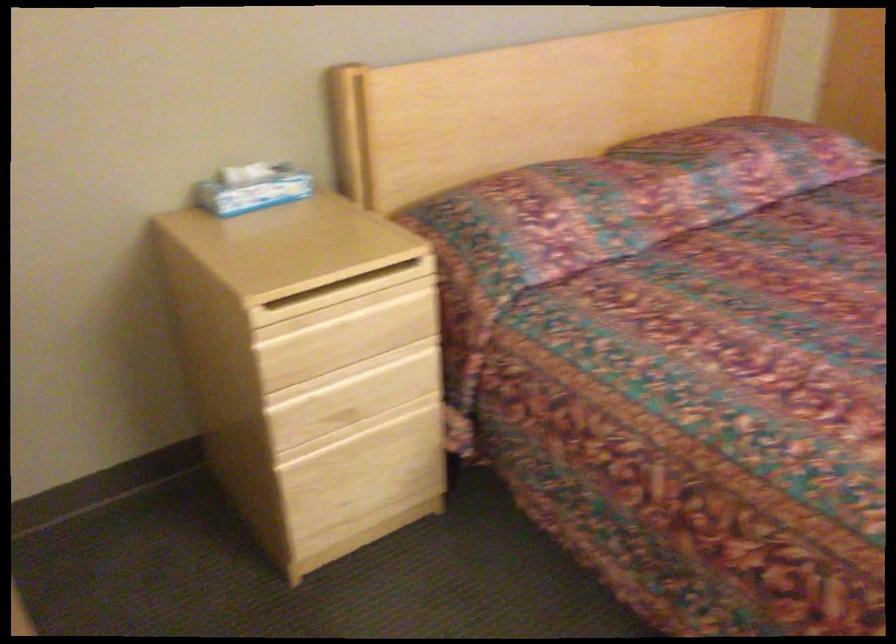
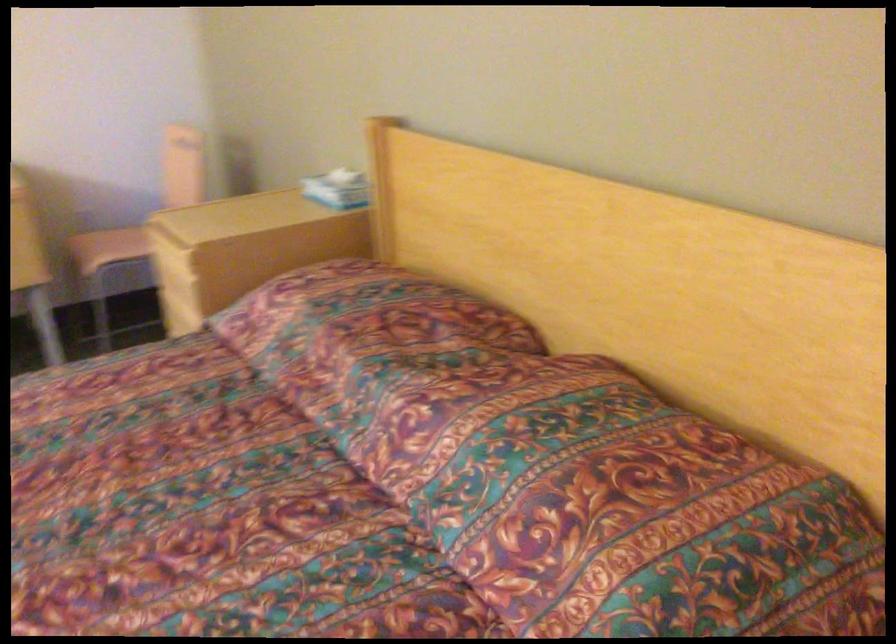
In the second image, find the point that corresponds to pixel 627 178 in the first image.

(354, 325)